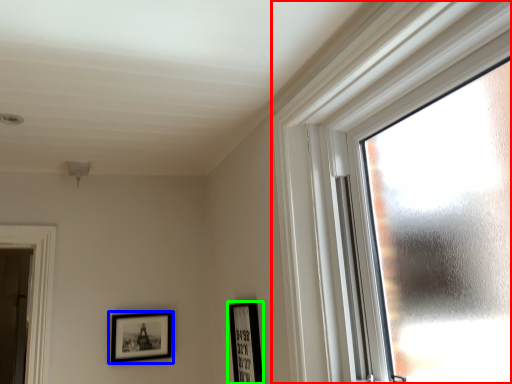
Question: Based on their relative distances, which object is farther from window (highlighted by a red box)? Choose from picture frame (highlighted by a blue box) and picture frame (highlighted by a green box).

Choices:
 (A) picture frame
 (B) picture frame

Answer: (A)